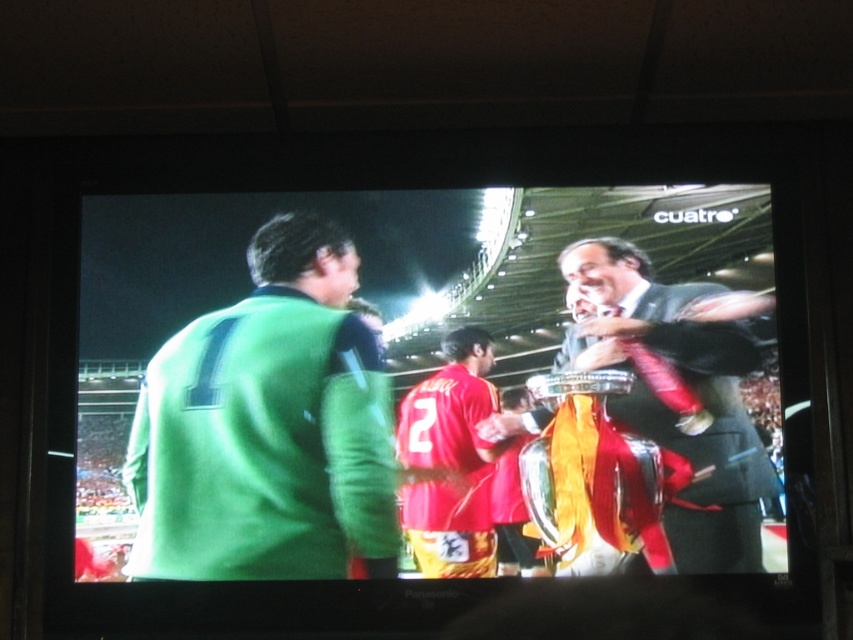
Which is above, green jersey at center or shiny black suit at center?

shiny black suit at center is above.

Can you confirm if green jersey at center is positioned to the left of shiny black suit at center?

Indeed, green jersey at center is positioned on the left side of shiny black suit at center.

Identify the location of green jersey at center. Image resolution: width=853 pixels, height=640 pixels. (268, 428).

What do you see at coordinates (680, 392) in the screenshot?
I see `shiny black suit at center` at bounding box center [680, 392].

Who is more distant from viewer, (619, 285) or (440, 384)?

Result: Positioned behind is point (619, 285).

The image size is (853, 640). In order to click on shiny black suit at center in this screenshot , I will do `click(680, 392)`.

Between point (337, 298) and point (412, 420), which one is positioned behind?

Point (337, 298)

Is the position of green jersey at center less distant than that of red jersey at center?

No, green jersey at center is behind red jersey at center.

I want to click on green jersey at center, so click(x=268, y=428).